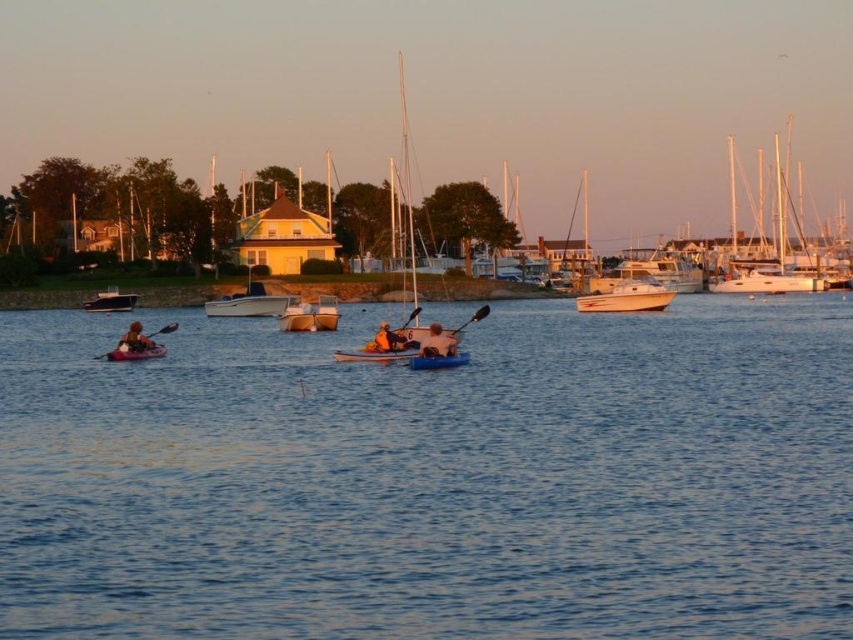
Can you confirm if blue plastic canoe at center is smaller than matte pink kayak at left?

Yes.

Which of these two, blue plastic canoe at center or matte pink kayak at left, stands shorter?

Standing shorter between the two is blue plastic canoe at center.

This screenshot has height=640, width=853. What do you see at coordinates (438, 360) in the screenshot?
I see `blue plastic canoe at center` at bounding box center [438, 360].

Identify the location of blue plastic canoe at center. This screenshot has height=640, width=853. (438, 360).

Who is positioned more to the right, blue plastic canoe at center or matte blue kayak at left?

Positioned to the right is blue plastic canoe at center.

Between point (445, 356) and point (106, 356), which one is positioned in front?

Point (445, 356) is more forward.

At what (x,y) coordinates should I click in order to perform the action: click on blue plastic canoe at center. Please return your answer as a coordinate pair (x, y). The width and height of the screenshot is (853, 640). Looking at the image, I should click on click(x=438, y=360).

You are a GUI agent. You are given a task and a screenshot of the screen. Output one action in this format:
    pyautogui.click(x=<x>, y=<y>)
    Task: Click on the blue plastic canoe at center
    
    Given the screenshot: What is the action you would take?
    pyautogui.click(x=438, y=360)

Which is more to the left, matte blue canoe at center or black plastic paddle at center?

matte blue canoe at center is more to the left.

Is point (383, 355) closer to camera compared to point (399, 332)?

Yes, point (383, 355) is closer to viewer.

What do you see at coordinates (374, 355) in the screenshot? The width and height of the screenshot is (853, 640). I see `matte blue canoe at center` at bounding box center [374, 355].

Image resolution: width=853 pixels, height=640 pixels. What are the coordinates of `matte blue canoe at center` in the screenshot? It's located at [x=374, y=355].